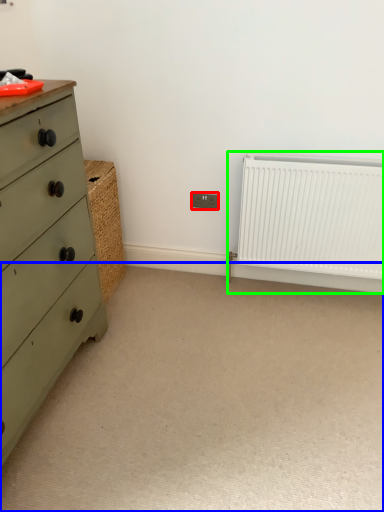
Question: Considering the real-world distances, which object is closest to electric outlet (highlighted by a red box)? plain (highlighted by a blue box) or radiator (highlighted by a green box).

Choices:
 (A) plain
 (B) radiator

Answer: (B)